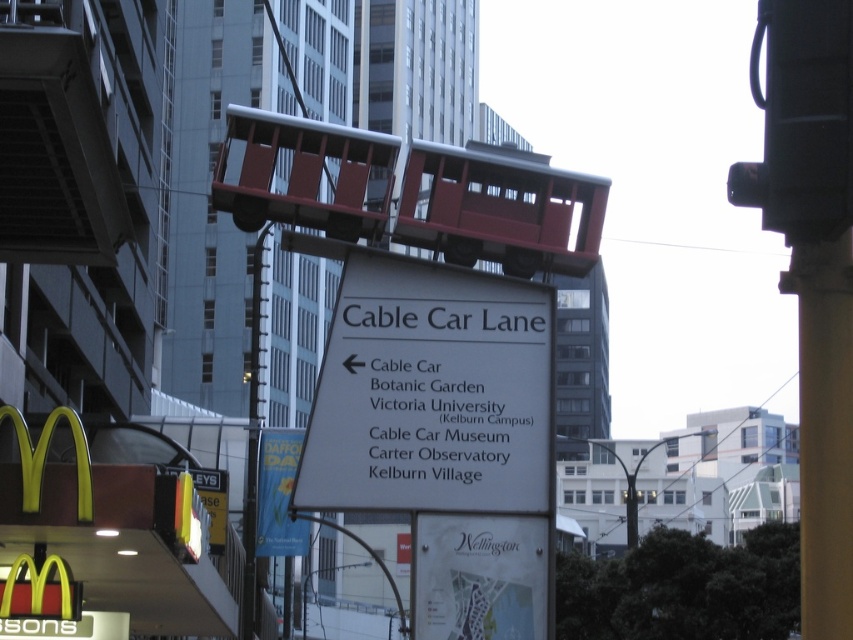
Is white paper map at center to the left of metallic pole at center-left from the viewer's perspective?

In fact, white paper map at center is to the right of metallic pole at center-left.

Is point (415, 541) positioned after point (247, 474)?

That is False.

Locate an element on the screen. The height and width of the screenshot is (640, 853). white paper map at center is located at coordinates (480, 577).

Can you confirm if white plastic sign at center is wider than yellow paper sign at center?

Indeed, white plastic sign at center has a greater width compared to yellow paper sign at center.

This screenshot has height=640, width=853. What do you see at coordinates (431, 394) in the screenshot?
I see `white plastic sign at center` at bounding box center [431, 394].

Does point (334, 396) come in front of point (258, 492)?

That is True.

Locate an element on the screen. This screenshot has height=640, width=853. white plastic sign at center is located at coordinates 431,394.

Which of these two, white plastic sign at center or metallic pole at center-left, stands taller?

metallic pole at center-left

What do you see at coordinates (431, 394) in the screenshot? I see `white plastic sign at center` at bounding box center [431, 394].

Find the location of a particular element. The image size is (853, 640). white plastic sign at center is located at coordinates (431, 394).